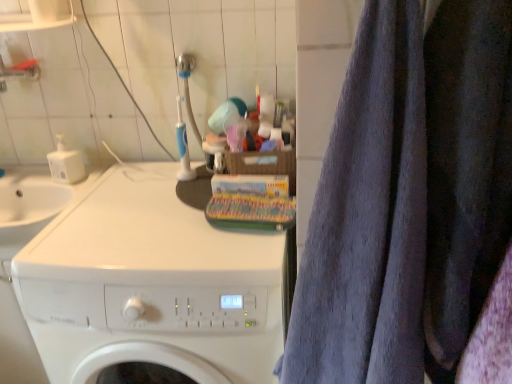
Question: From a real-world perspective, is white glossy washing machine at center positioned over gray terry cloth towel at right based on gravity?

Choices:
 (A) yes
 (B) no

Answer: (B)

Question: Is the depth of white glossy washing machine at center greater than that of gray terry cloth towel at right?

Choices:
 (A) no
 (B) yes

Answer: (B)

Question: Does white glossy washing machine at center have a lesser width compared to gray terry cloth towel at right?

Choices:
 (A) yes
 (B) no

Answer: (B)

Question: Considering the relative positions of white glossy washing machine at center and gray terry cloth towel at right in the image provided, is white glossy washing machine at center to the left of gray terry cloth towel at right from the viewer's perspective?

Choices:
 (A) no
 (B) yes

Answer: (B)

Question: Could you tell me if white glossy washing machine at center is facing gray terry cloth towel at right?

Choices:
 (A) no
 (B) yes

Answer: (A)

Question: Is gray terry cloth towel at right spatially inside dark blue fabric at right, or outside of it?

Choices:
 (A) outside
 (B) inside

Answer: (A)

Question: Is gray terry cloth towel at right in front of or behind dark blue fabric at right in the image?

Choices:
 (A) behind
 (B) front

Answer: (B)

Question: In the image, is gray terry cloth towel at right on the left side or the right side of dark blue fabric at right?

Choices:
 (A) right
 (B) left

Answer: (B)

Question: From a real-world perspective, is gray terry cloth towel at right above or below dark blue fabric at right?

Choices:
 (A) below
 (B) above

Answer: (A)

Question: Is gray terry cloth towel at right situated inside white glossy washing machine at center or outside?

Choices:
 (A) inside
 (B) outside

Answer: (B)

Question: Considering the positions of point (406, 137) and point (181, 264), is point (406, 137) closer or farther from the camera than point (181, 264)?

Choices:
 (A) closer
 (B) farther

Answer: (A)

Question: Is gray terry cloth towel at right bigger or smaller than white glossy washing machine at center?

Choices:
 (A) small
 (B) big

Answer: (A)

Question: Considering the positions of gray terry cloth towel at right and white glossy washing machine at center in the image, is gray terry cloth towel at right taller or shorter than white glossy washing machine at center?

Choices:
 (A) short
 (B) tall

Answer: (A)

Question: From their relative heights in the image, would you say dark blue fabric at right is taller or shorter than gray terry cloth towel at right?

Choices:
 (A) short
 (B) tall

Answer: (A)

Question: Does point tap(493, 172) appear closer or farther from the camera than point tap(377, 34)?

Choices:
 (A) farther
 (B) closer

Answer: (A)